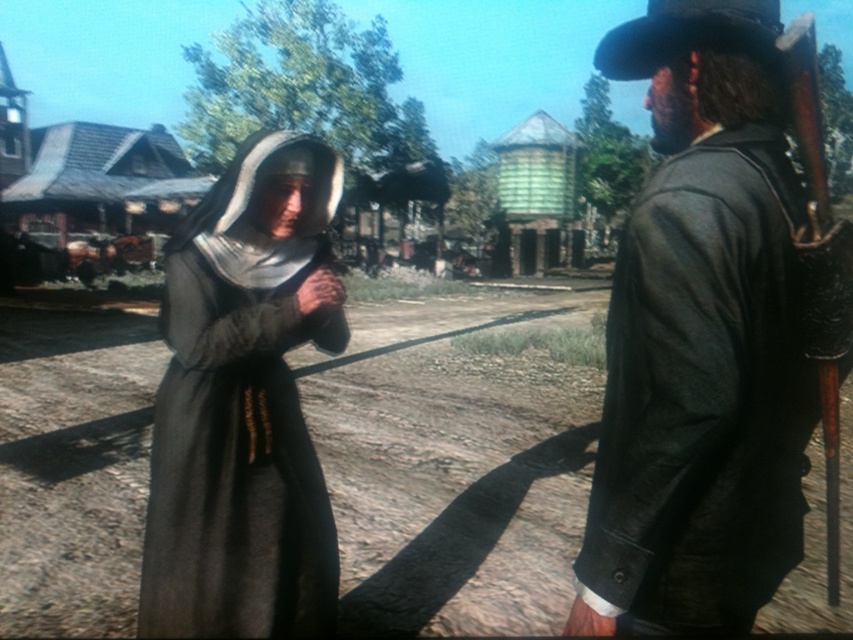
Does leather jacket at right have a greater width compared to black felt cowboy hat at upper right?

Yes.

Between point (799, 186) and point (699, 24), which one is positioned in front?

Positioned in front is point (699, 24).

Locate an element on the screen. leather jacket at right is located at coordinates (700, 339).

Does leather jacket at right have a lesser width compared to gray woolen robe at center?

Yes, leather jacket at right is thinner than gray woolen robe at center.

What do you see at coordinates (700, 339) in the screenshot? This screenshot has width=853, height=640. I see `leather jacket at right` at bounding box center [700, 339].

Does point (567, 614) come closer to viewer compared to point (271, 432)?

Yes.

This screenshot has height=640, width=853. What are the coordinates of `leather jacket at right` in the screenshot? It's located at (700, 339).

Can you confirm if gray woolen robe at center is taller than black felt cowboy hat at upper right?

Yes, gray woolen robe at center is taller than black felt cowboy hat at upper right.

Which of these two, gray woolen robe at center or black felt cowboy hat at upper right, stands shorter?

black felt cowboy hat at upper right is shorter.

This screenshot has height=640, width=853. Identify the location of gray woolen robe at center. (242, 408).

Identify the location of gray woolen robe at center. (242, 408).